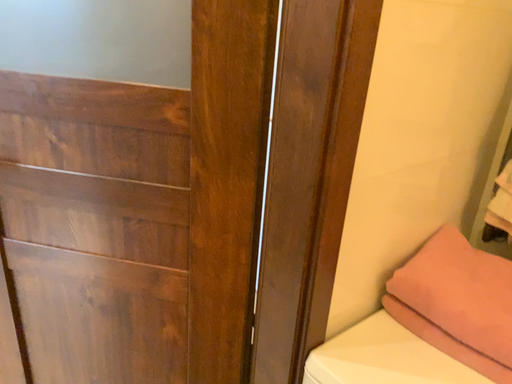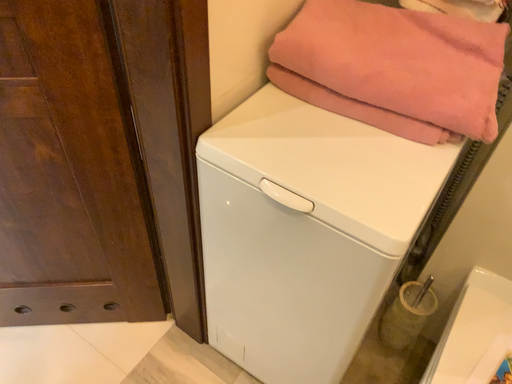
Question: How did the camera likely rotate when shooting the video?

Choices:
 (A) rotated downward
 (B) rotated upward

Answer: (A)